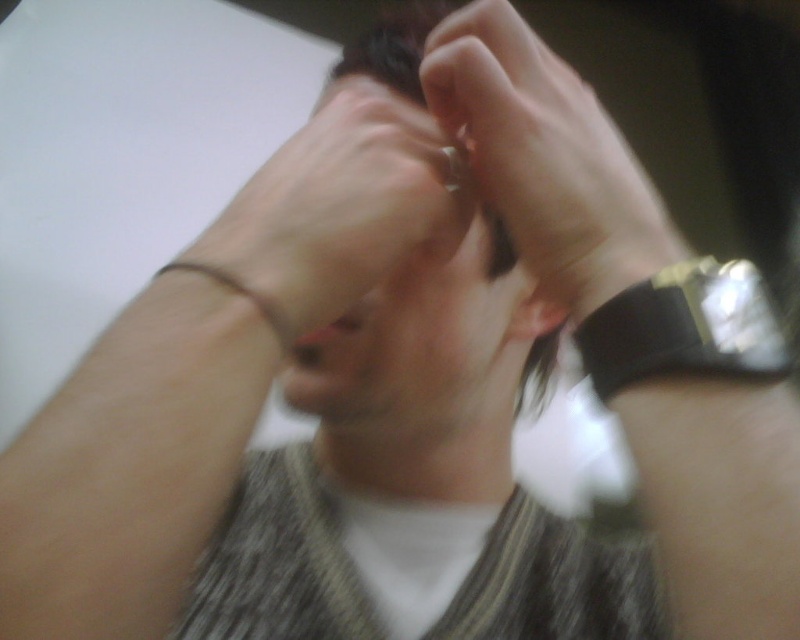
Question: Can you confirm if slightly translucent skin at center is positioned to the right of black rubber wristband at right?

Choices:
 (A) no
 (B) yes

Answer: (A)

Question: Based on their relative distances, which object is farther from the brown leather bracelet at left?

Choices:
 (A) slightly translucent skin at center
 (B) dark brown hair at center
 (C) black rubber wristband at right

Answer: (B)

Question: Which of the following is the farthest from the observer?

Choices:
 (A) brown leather bracelet at left
 (B) dark brown hair at center
 (C) black rubber wristband at right
 (D) slightly translucent skin at center

Answer: (B)

Question: Which point is farther to the camera?

Choices:
 (A) dark brown hair at center
 (B) black rubber wristband at right
 (C) slightly translucent skin at center
 (D) brown leather bracelet at left

Answer: (A)

Question: Does dark brown hair at center have a smaller size compared to brown leather bracelet at left?

Choices:
 (A) yes
 (B) no

Answer: (B)

Question: Is dark brown hair at center positioned before brown leather bracelet at left?

Choices:
 (A) no
 (B) yes

Answer: (A)